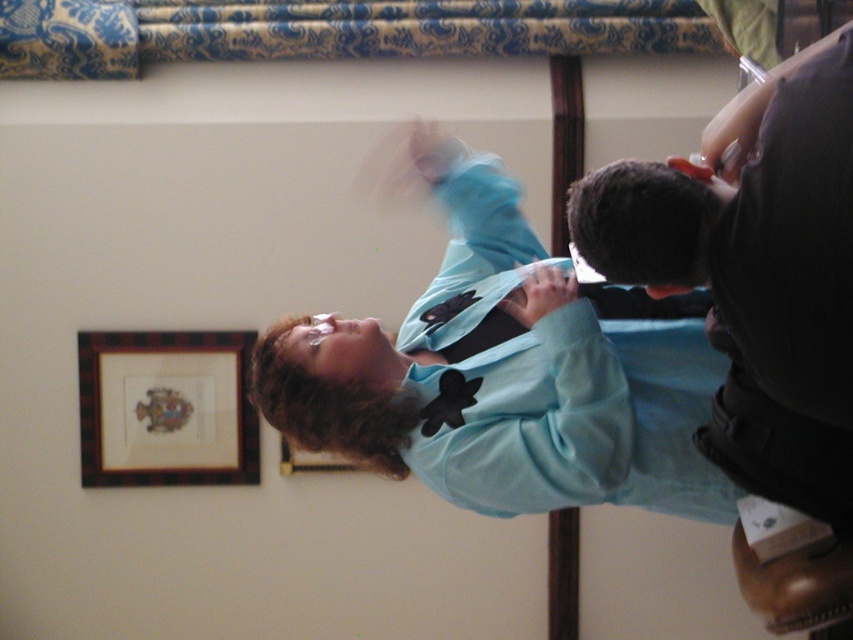
Question: Is the position of black satin bow tie at center less distant than that of wooden plaque at center?

Choices:
 (A) no
 (B) yes

Answer: (B)

Question: Which point is farther from the camera taking this photo?

Choices:
 (A) (329, 452)
 (B) (447, 403)

Answer: (A)

Question: Does wooden picture frame at upper left have a greater width compared to black satin bow tie at center?

Choices:
 (A) no
 (B) yes

Answer: (B)

Question: Which object is closer to the camera taking this photo?

Choices:
 (A) black satin bow tie at center
 (B) wooden plaque at center

Answer: (A)

Question: Which point is closer to the camera?

Choices:
 (A) (105, 374)
 (B) (282, 436)

Answer: (A)

Question: Can you confirm if wooden picture frame at upper left is positioned below black satin bow tie at center?

Choices:
 (A) no
 (B) yes

Answer: (B)